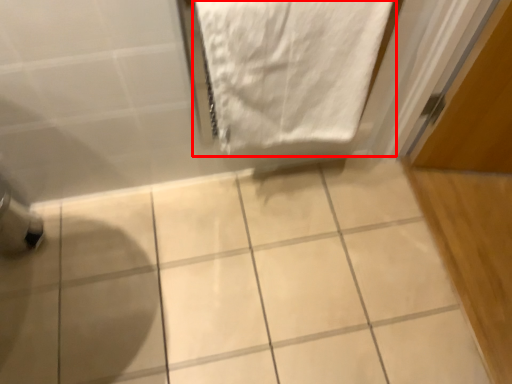
Question: From the image's perspective, what is the correct spatial relationship of towel (annotated by the red box) in relation to ceramic tile?

Choices:
 (A) below
 (B) above

Answer: (B)